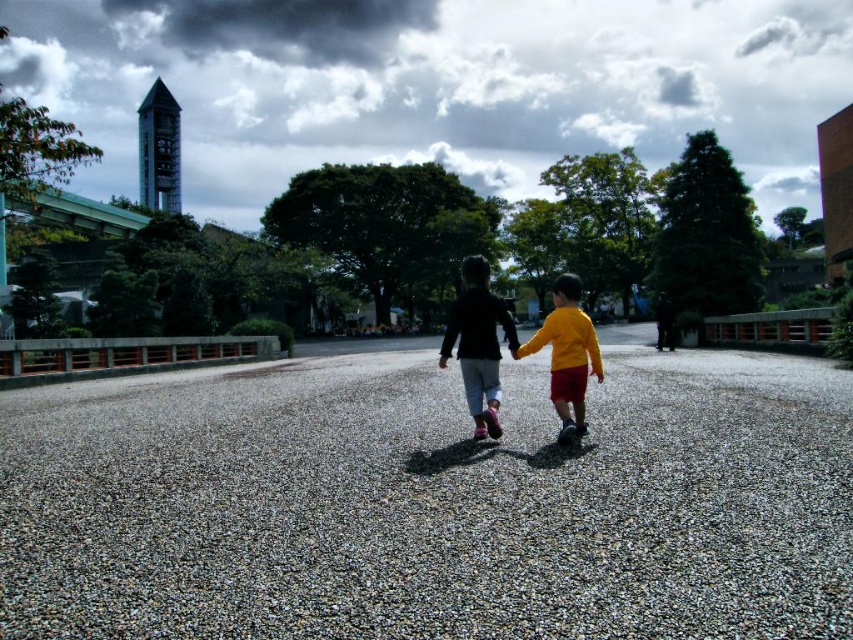
You are a photographer trying to capture the children walking on the gray gravel at center while ensuring the matte black jacket at center is visible. Which area should you focus on to include both elements without overcrowding the frame?

Since the gray gravel at center occupies less space than the matte black jacket at center, focusing on the area where the matte black jacket at center is located will allow you to capture both elements while ensuring the jacket remains prominent without overwhelming the frame.

Looking at this image, you are a photographer positioned at the edge of the pathway. You want to capture a photo where both the gray gravel at center and the matte black pants at center are clearly visible in the frame. Given their distance apart, can you estimate if they will both fit within a standard camera frame that has a 6.00 meter field of view?

The gray gravel at center and matte black pants at center are 5.00 meters apart from each other. Since the camera frame has a 6.00 meter field of view, they will both fit within the frame as the distance between them is less than the field of view.

You are a drone operator trying to capture a photo of the two children walking on the gray gravel at center. To ensure the gravel is clearly visible in the photo, where should you position the drone relative to the children?

The gray gravel at center is located at point (x=430, y=502), so the drone should be positioned directly above that coordinate to capture the gravel clearly.